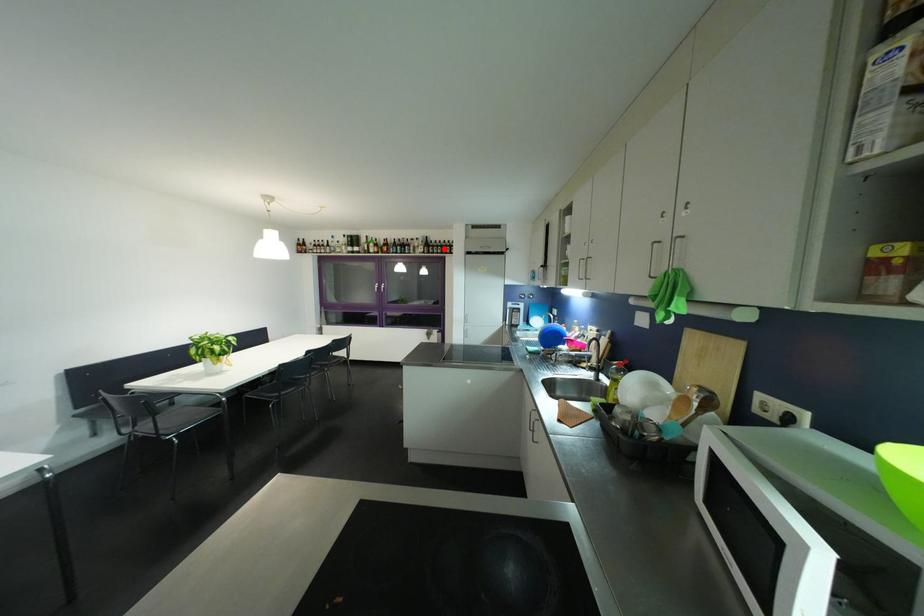
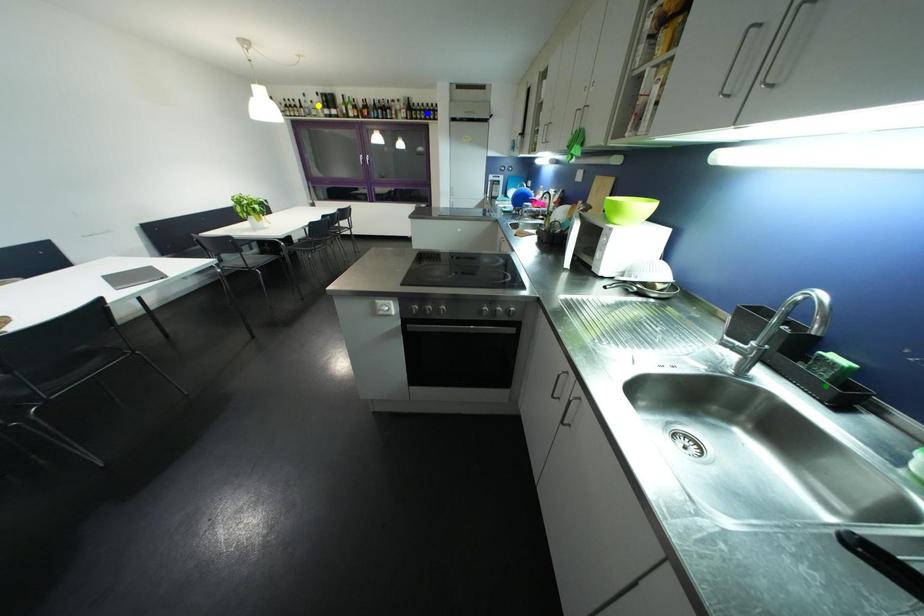
Question: I am providing you with two images of the same scene from different viewpoints. A red point is marked on the first image. You are given multiple points on the second image. Which spot in image 2 lines up with the point in image 1?

Choices:
 (A) blue point
 (B) green point
 (C) yellow point

Answer: (A)